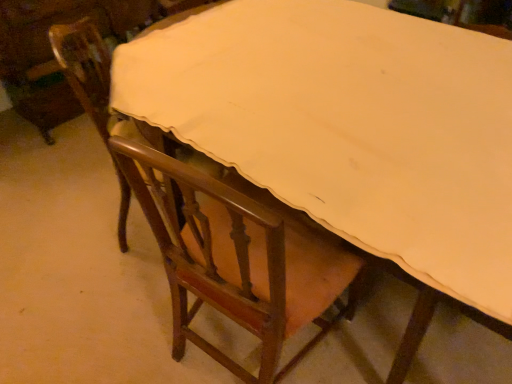
Describe the element at coordinates (238, 261) in the screenshot. The width and height of the screenshot is (512, 384). I see `wooden chair at center, the second chair when ordered from left to right` at that location.

What is the approximate width of wooden chair at center, which is the first chair from right to left?

The width of wooden chair at center, which is the first chair from right to left, is 17.85 inches.

Where is `wooden chair at center, which is the first chair from right to left`? wooden chair at center, which is the first chair from right to left is located at coordinates (238, 261).

What is the approximate height of wooden chair at center, which is the first chair from right to left?

wooden chair at center, which is the first chair from right to left, is 36.60 inches in height.

This screenshot has height=384, width=512. Describe the element at coordinates (90, 75) in the screenshot. I see `wooden chair at left, the 2th chair when ordered from right to left` at that location.

You are a GUI agent. You are given a task and a screenshot of the screen. Output one action in this format:
    pyautogui.click(x=<x>, y=<y>)
    Task: Click on the wooden chair at left, placed as the 1th chair when sorted from left to right
    The width and height of the screenshot is (512, 384).
    Given the screenshot: What is the action you would take?
    pyautogui.click(x=90, y=75)

Locate an element on the screen. The image size is (512, 384). wooden chair at center, the second chair when ordered from left to right is located at coordinates (238, 261).

Is wooden chair at center, the second chair when ordered from left to right, at the left side of wooden chair at left, placed as the 1th chair when sorted from left to right?

No.

Which object is closer to the camera, wooden chair at center, which is the first chair from right to left, or wooden chair at left, the 2th chair when ordered from right to left?

wooden chair at center, which is the first chair from right to left, is in front.

Which is closer to the camera, [218,180] or [106,75]?

Clearly, point [218,180] is closer to the camera than point [106,75].

From the image's perspective, is wooden chair at center, the second chair when ordered from left to right, located above or below wooden chair at left, placed as the 1th chair when sorted from left to right?

Clearly, from the image's perspective, wooden chair at center, the second chair when ordered from left to right, is below wooden chair at left, placed as the 1th chair when sorted from left to right.

From a real-world perspective, who is located higher, wooden chair at center, which is the first chair from right to left, or wooden chair at left, placed as the 1th chair when sorted from left to right?

wooden chair at center, which is the first chair from right to left, is physically above.

Considering the relative sizes of wooden chair at center, the second chair when ordered from left to right, and wooden chair at left, placed as the 1th chair when sorted from left to right, in the image provided, is wooden chair at center, the second chair when ordered from left to right, wider than wooden chair at left, placed as the 1th chair when sorted from left to right,?

Correct, the width of wooden chair at center, the second chair when ordered from left to right, exceeds that of wooden chair at left, placed as the 1th chair when sorted from left to right.

Considering the sizes of objects wooden chair at center, which is the first chair from right to left, and wooden chair at left, the 2th chair when ordered from right to left, in the image provided, who is shorter, wooden chair at center, which is the first chair from right to left, or wooden chair at left, the 2th chair when ordered from right to left,?

wooden chair at left, the 2th chair when ordered from right to left.

Considering the sizes of objects wooden chair at center, which is the first chair from right to left, and wooden chair at left, placed as the 1th chair when sorted from left to right, in the image provided, who is bigger, wooden chair at center, which is the first chair from right to left, or wooden chair at left, placed as the 1th chair when sorted from left to right,?

Bigger between the two is wooden chair at center, which is the first chair from right to left.

Is wooden chair at center, the second chair when ordered from left to right, not inside wooden chair at left, placed as the 1th chair when sorted from left to right?

Yes, wooden chair at center, the second chair when ordered from left to right, is not within wooden chair at left, placed as the 1th chair when sorted from left to right.

Would you consider wooden chair at center, the second chair when ordered from left to right, to be distant from wooden chair at left, placed as the 1th chair when sorted from left to right?

No, wooden chair at center, the second chair when ordered from left to right, is in close proximity to wooden chair at left, placed as the 1th chair when sorted from left to right.

Is wooden chair at center, which is the first chair from right to left, facing towards wooden chair at left, placed as the 1th chair when sorted from left to right?

No, wooden chair at center, which is the first chair from right to left, is not turned towards wooden chair at left, placed as the 1th chair when sorted from left to right.

What's the angular difference between wooden chair at center, the second chair when ordered from left to right, and wooden chair at left, placed as the 1th chair when sorted from left to right,'s facing directions?

42.4 degrees separate the facing orientations of wooden chair at center, the second chair when ordered from left to right, and wooden chair at left, placed as the 1th chair when sorted from left to right.

This screenshot has width=512, height=384. What are the coordinates of `chair in front of the wooden chair at left, the 2th chair when ordered from right to left` in the screenshot? It's located at (238, 261).

Would you say wooden chair at left, placed as the 1th chair when sorted from left to right, is to the left or to the right of wooden chair at center, which is the first chair from right to left, in the picture?

Clearly, wooden chair at left, placed as the 1th chair when sorted from left to right, is on the left of wooden chair at center, which is the first chair from right to left, in the image.

Is wooden chair at left, the 2th chair when ordered from right to left, positioned behind wooden chair at center, which is the first chair from right to left?

Yes, it is behind wooden chair at center, which is the first chair from right to left.

Does point (98, 132) come closer to viewer compared to point (286, 368)?

No, (98, 132) is behind (286, 368).

Consider the image. From the image's perspective, which object appears higher, wooden chair at left, the 2th chair when ordered from right to left, or wooden chair at center, which is the first chair from right to left?

From the image's view, wooden chair at left, the 2th chair when ordered from right to left, is above.

From a real-world perspective, is wooden chair at left, placed as the 1th chair when sorted from left to right, over wooden chair at center, the second chair when ordered from left to right?

No, from a real-world perspective, wooden chair at left, placed as the 1th chair when sorted from left to right, is not on top of wooden chair at center, the second chair when ordered from left to right.

Looking at their sizes, would you say wooden chair at left, the 2th chair when ordered from right to left, is wider or thinner than wooden chair at center, which is the first chair from right to left?

Considering their sizes, wooden chair at left, the 2th chair when ordered from right to left, looks slimmer than wooden chair at center, which is the first chair from right to left.

Does wooden chair at left, placed as the 1th chair when sorted from left to right, have a greater height compared to wooden chair at center, which is the first chair from right to left?

No.

Considering the sizes of objects wooden chair at left, the 2th chair when ordered from right to left, and wooden chair at center, which is the first chair from right to left, in the image provided, who is bigger, wooden chair at left, the 2th chair when ordered from right to left, or wooden chair at center, which is the first chair from right to left,?

With larger size is wooden chair at center, which is the first chair from right to left.

Consider the image. Does wooden chair at left, the 2th chair when ordered from right to left, contain wooden chair at center, the second chair when ordered from left to right?

No, wooden chair at center, the second chair when ordered from left to right, is located outside of wooden chair at left, the 2th chair when ordered from right to left.

Is wooden chair at left, placed as the 1th chair when sorted from left to right, next to wooden chair at center, the second chair when ordered from left to right?

wooden chair at left, placed as the 1th chair when sorted from left to right, and wooden chair at center, the second chair when ordered from left to right, are clearly separated.

Is wooden chair at left, the 2th chair when ordered from right to left, facing away from wooden chair at center, the second chair when ordered from left to right?

No, wooden chair at left, the 2th chair when ordered from right to left,'s orientation is not away from wooden chair at center, the second chair when ordered from left to right.

There is a wooden chair at left, the 2th chair when ordered from right to left. At what (x,y) coordinates should I click in order to perform the action: click on chair above it (from a real-world perspective). Please return your answer as a coordinate pair (x, y). Image resolution: width=512 pixels, height=384 pixels. Looking at the image, I should click on (238, 261).

This screenshot has height=384, width=512. Find the location of `chair that appears behind the wooden chair at center, which is the first chair from right to left`. chair that appears behind the wooden chair at center, which is the first chair from right to left is located at coordinates (90, 75).

Locate an element on the screen. chair below the wooden chair at center, which is the first chair from right to left (from a real-world perspective) is located at coordinates (90, 75).